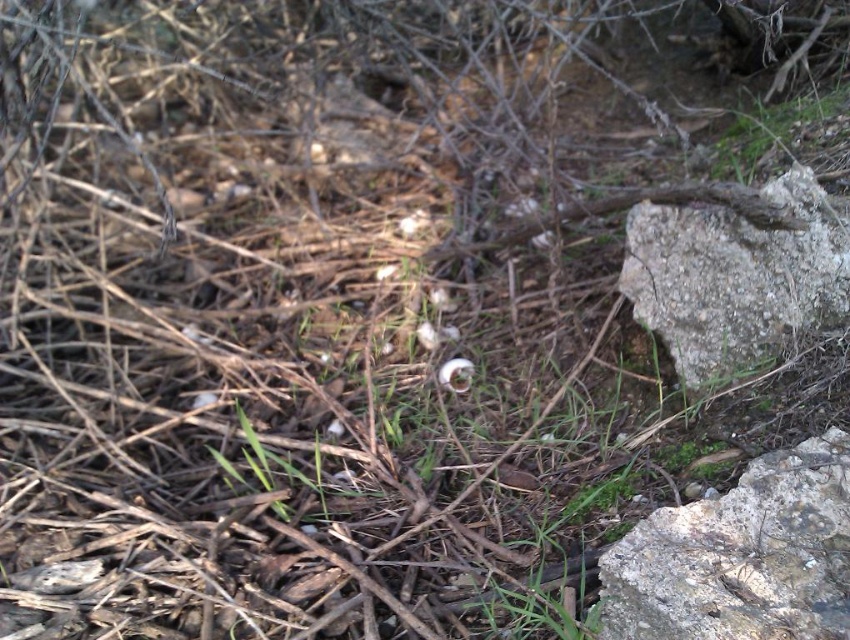
You are a hiker who wants to place a small marker between the gray rough rock at right and the white matte flower at center. Which object should you place the marker closer to if you want it to be closer to the taller object?

The gray rough rock at right is taller than the white matte flower at center, so you should place the marker closer to the gray rough rock at right to be near the taller object.

You are a hiker who wants to place the white matte flower at center on top of the gray rough rock at lower right. Considering their sizes, will the flower fit without hanging over the edges?

The gray rough rock at lower right is larger in size than the white matte flower at center, so the flower will fit without hanging over the edges.

In the scene shown: You are standing at the bottom right corner of the forest floor scene. You see two points marked on the ground. One is at point (656, 561) and the other at point (446, 360). Which point is closer to you?

Point (656, 561) is in front of point (446, 360), so it is closer to you.